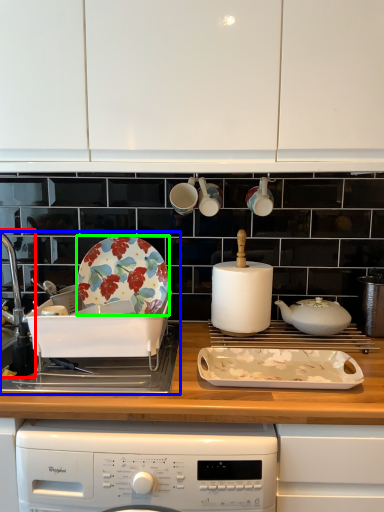
Question: Which object is the closest to the sink (highlighted by a red box)? Choose among these: sink (highlighted by a blue box) or plate (highlighted by a green box).

Choices:
 (A) sink
 (B) plate

Answer: (A)